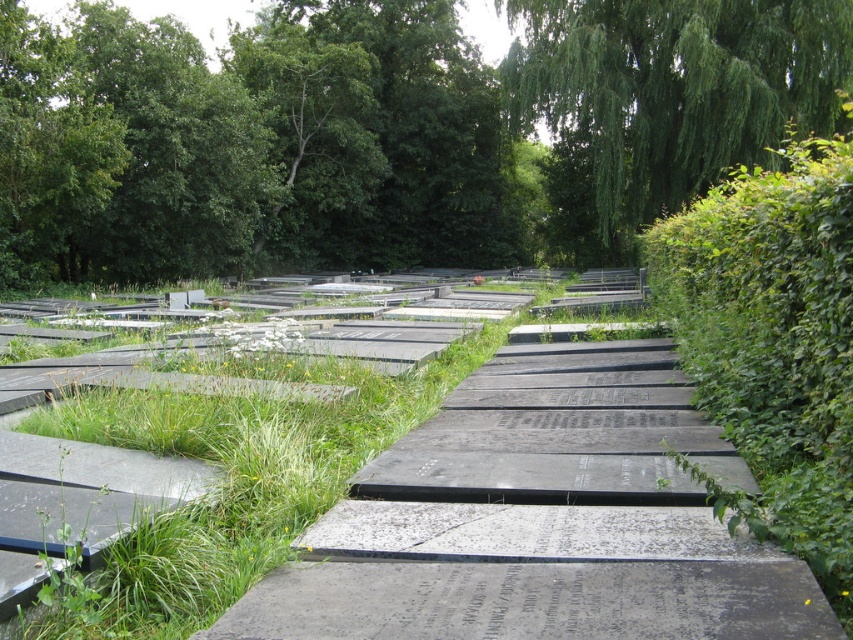
Who is higher up, green leafy hedge at right or green leafy tree at upper right?

green leafy tree at upper right is higher up.

Between green leafy hedge at right and green leafy tree at upper right, which one appears on the right side from the viewer's perspective?

Answer: From the viewer's perspective, green leafy tree at upper right appears more on the right side.

Which is in front, point (850, 196) or point (816, 74)?

Point (850, 196)

The image size is (853, 640). Find the location of `green leafy hedge at right`. green leafy hedge at right is located at coordinates (773, 344).

Can you confirm if green leafy tree at upper center is bigger than green leafy tree at upper right?

Yes, green leafy tree at upper center is bigger than green leafy tree at upper right.

Is point (496, 252) farther from camera compared to point (631, 176)?

Yes, point (496, 252) is behind point (631, 176).

Is point (419, 100) positioned behind point (761, 145)?

That is True.

Identify the location of green leafy tree at upper center. This screenshot has height=640, width=853. (247, 144).

Is point (433, 70) closer to viewer compared to point (775, 296)?

That is False.

Which is behind, point (248, 84) or point (706, 220)?

The point (248, 84) is more distant.

Is point (369, 113) behind point (659, 275)?

Yes, it is behind point (659, 275).

You are a GUI agent. You are given a task and a screenshot of the screen. Output one action in this format:
    pyautogui.click(x=<x>, y=<y>)
    Task: Click on the green leafy tree at upper center
    
    Given the screenshot: What is the action you would take?
    pyautogui.click(x=247, y=144)